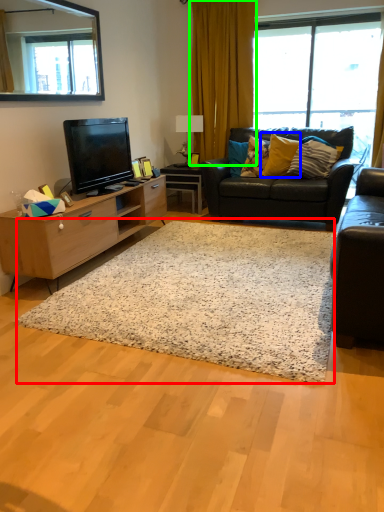
Question: Estimate the real-world distances between objects in this image. Which object is closer to plain (highlighted by a red box), pillow (highlighted by a blue box) or curtain (highlighted by a green box)?

Choices:
 (A) pillow
 (B) curtain

Answer: (A)